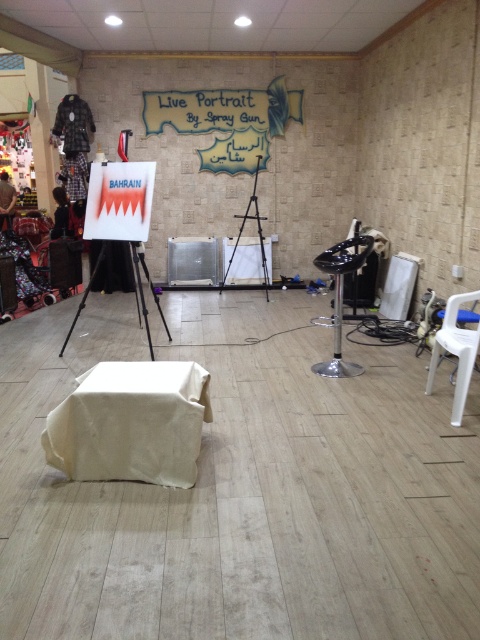
Is white plastic chair at lower right below wooden tripod at center?

Yes, white plastic chair at lower right is below wooden tripod at center.

Is point (459, 353) positioned in front of point (262, 260)?

Yes, point (459, 353) is in front of point (262, 260).

You are a GUI agent. You are given a task and a screenshot of the screen. Output one action in this format:
    pyautogui.click(x=<x>, y=<y>)
    Task: Click on the white plastic chair at lower right
    
    Given the screenshot: What is the action you would take?
    pyautogui.click(x=456, y=349)

Is white plastic chair at lower right taller than black glossy chair at center right?

No.

Can you confirm if white plastic chair at lower right is positioned to the right of black glossy chair at center right?

Yes, white plastic chair at lower right is to the right of black glossy chair at center right.

Image resolution: width=480 pixels, height=640 pixels. What do you see at coordinates (456, 349) in the screenshot?
I see `white plastic chair at lower right` at bounding box center [456, 349].

At what (x,y) coordinates should I click in order to perform the action: click on white plastic chair at lower right. Please return your answer as a coordinate pair (x, y). The height and width of the screenshot is (640, 480). Looking at the image, I should click on (456, 349).

Who is higher up, white matte tripod at center or wooden tripod at center?

wooden tripod at center

In the scene shown: Between white matte tripod at center and wooden tripod at center, which one appears on the right side from the viewer's perspective?

Positioned to the right is wooden tripod at center.

The height and width of the screenshot is (640, 480). Describe the element at coordinates (143, 292) in the screenshot. I see `white matte tripod at center` at that location.

You are a GUI agent. You are given a task and a screenshot of the screen. Output one action in this format:
    pyautogui.click(x=<x>, y=<y>)
    Task: Click on the white matte tripod at center
    This screenshot has width=480, height=640.
    Given the screenshot: What is the action you would take?
    pyautogui.click(x=143, y=292)